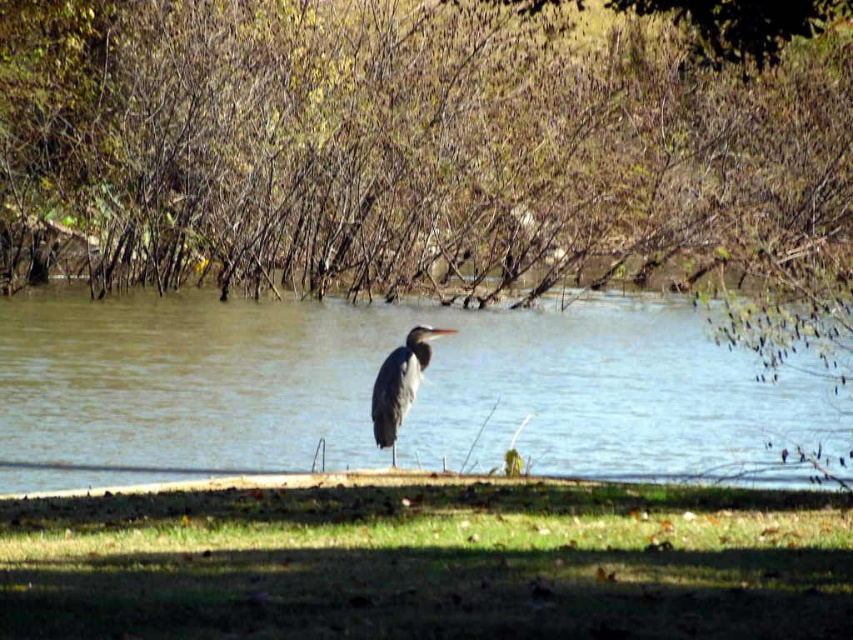
You are a photographer trying to capture the gray matte bird at center while standing on the green grass at lower center. Can you safely approach the bird without getting too close? The minimum safe distance for photographing birds is 4 meters.

The green grass at lower center and gray matte bird at center are 3.67 meters apart from each other. Since the minimum safe distance is 4 meters, you are currently too close to the bird. Move back to ensure you are at least 4 meters away before taking the photo.

You are a photographer aiming to capture the reflection of the clear water at center in your shot. Since the green grass at lower center might block the view, can you adjust your position to ensure the reflection is fully visible?

The green grass at lower center is positioned under clear water at center, so moving your camera position lower or adjusting the angle to look past the grass could allow the reflection of the clear water at center to be fully visible.

You are a photographer trying to capture the bird in the scene. You need to decide which area to focus on to ensure the green grass at lower center and the clear water at center are both visible in the frame. Given their widths, which area should you prioritize to avoid cropping either?

The green grass at lower center has a smaller width compared to the clear water at center. To ensure both are visible without cropping, prioritize focusing on the clear water at center since it occupies more space in the frame.